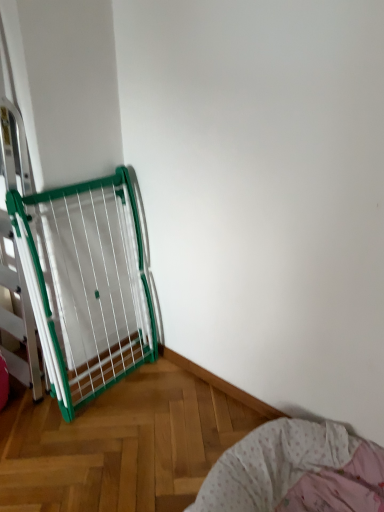
Describe the element at coordinates (295, 471) in the screenshot. I see `pink fabric bed at lower right` at that location.

Find the location of a particular element. This screenshot has width=384, height=512. pink fabric bed at lower right is located at coordinates (295, 471).

Measure the distance between pink fabric bed at lower right and camera.

pink fabric bed at lower right and camera are 4.34 feet apart from each other.

Where is `pink fabric bed at lower right`? The height and width of the screenshot is (512, 384). pink fabric bed at lower right is located at coordinates (295, 471).